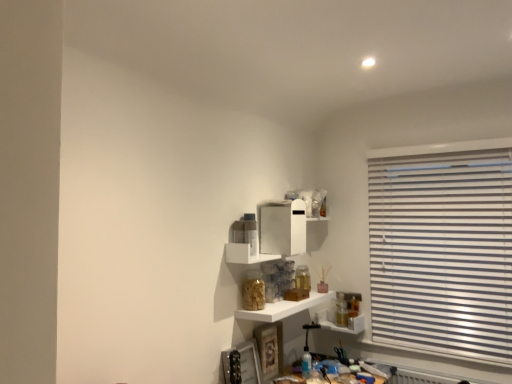
Locate an element on the screen. This screenshot has height=384, width=512. white glossy shelf at center, which is the second shelf from top to bottom is located at coordinates (284, 308).

Locate an element on the screen. The width and height of the screenshot is (512, 384). translucent glass jar at lower right, which appears as the first shelf when ordered from the bottom is located at coordinates (338, 325).

Does white glossy shelf at center, the 2th shelf when ordered from bottom to top, have a greater width compared to translucent glass jar at lower right, which appears as the first shelf when ordered from the bottom?

Yes.

Based on the photo, is white glossy shelf at center, the 2th shelf when ordered from bottom to top, looking in the opposite direction of translucent glass jar at lower right, which is the 3th shelf in top-to-bottom order?

No, translucent glass jar at lower right, which is the 3th shelf in top-to-bottom order, is not at the back of white glossy shelf at center, the 2th shelf when ordered from bottom to top.

Which object is closer to the camera, white glossy shelf at center, which is the second shelf from top to bottom, or translucent glass jar at lower right, which appears as the first shelf when ordered from the bottom?

white glossy shelf at center, which is the second shelf from top to bottom, is more forward.

Measure the distance from white glossy shelf at center, which is the second shelf from top to bottom, to translucent glass jar at lower right, which is the 3th shelf in top-to-bottom order.

The distance of white glossy shelf at center, which is the second shelf from top to bottom, from translucent glass jar at lower right, which is the 3th shelf in top-to-bottom order, is 43.45 centimeters.

From the image's perspective, relative to white glossy shelf at center, the 2th shelf when ordered from bottom to top, is translucent glass jar at lower right, which appears as the first shelf when ordered from the bottom, above or below?

Based on their image positions, translucent glass jar at lower right, which appears as the first shelf when ordered from the bottom, is located beneath white glossy shelf at center, the 2th shelf when ordered from bottom to top.

Looking at this image, is translucent glass jar at lower right, which appears as the first shelf when ordered from the bottom, not within white glossy shelf at center, which is the second shelf from top to bottom?

translucent glass jar at lower right, which appears as the first shelf when ordered from the bottom, is positioned outside white glossy shelf at center, which is the second shelf from top to bottom.

Looking at this image, considering the relative sizes of translucent glass jar at lower right, which is the 3th shelf in top-to-bottom order, and white glossy shelf at center, the 2th shelf when ordered from bottom to top, in the image provided, is translucent glass jar at lower right, which is the 3th shelf in top-to-bottom order, smaller than white glossy shelf at center, the 2th shelf when ordered from bottom to top,?

Correct, translucent glass jar at lower right, which is the 3th shelf in top-to-bottom order, occupies less space than white glossy shelf at center, the 2th shelf when ordered from bottom to top.

Does white glossy shelf at center, which ranks as the third shelf in bottom-to-top order, contain white glossy shelf at center, which is the second shelf from top to bottom?

No, white glossy shelf at center, which is the second shelf from top to bottom, is not inside white glossy shelf at center, which ranks as the third shelf in bottom-to-top order.

From a real-world perspective, is white glossy shelf at center, which ranks as the third shelf in bottom-to-top order, positioned under white glossy shelf at center, the 2th shelf when ordered from bottom to top, based on gravity?

No, from a real-world perspective, white glossy shelf at center, which ranks as the third shelf in bottom-to-top order, is not under white glossy shelf at center, the 2th shelf when ordered from bottom to top.

Is white glossy shelf at center, which ranks as the third shelf in bottom-to-top order, not near white glossy shelf at center, which is the second shelf from top to bottom?

That's not correct — white glossy shelf at center, which ranks as the third shelf in bottom-to-top order, is a little close to white glossy shelf at center, which is the second shelf from top to bottom.

Is point (236, 313) closer to viewer compared to point (279, 255)?

Yes, it is.

Can you confirm if white glossy shelf at center, the 2th shelf when ordered from bottom to top, is thinner than white glossy shelf at center, which ranks as the third shelf in bottom-to-top order?

No, white glossy shelf at center, the 2th shelf when ordered from bottom to top, is not thinner than white glossy shelf at center, which ranks as the third shelf in bottom-to-top order.

Could white glossy shelf at center, the 1th shelf positioned from the top, be considered to be inside white glossy shelf at center, which is the second shelf from top to bottom?

No, white glossy shelf at center, the 1th shelf positioned from the top, is not surrounded by white glossy shelf at center, which is the second shelf from top to bottom.

How many degrees apart are the facing directions of white glossy shelf at center, the 2th shelf when ordered from bottom to top, and white glossy shelf at center, the 1th shelf positioned from the top?

white glossy shelf at center, the 2th shelf when ordered from bottom to top, and white glossy shelf at center, the 1th shelf positioned from the top, are facing 0.0439 degrees away from each other.

Who is bigger, white glossy shelf at center, which ranks as the third shelf in bottom-to-top order, or translucent glass jar at lower right, which appears as the first shelf when ordered from the bottom?

With larger size is white glossy shelf at center, which ranks as the third shelf in bottom-to-top order.

Where is `shelf that is the 2nd one above the translucent glass jar at lower right, which appears as the first shelf when ordered from the bottom (from a real-world perspective)`? This screenshot has height=384, width=512. shelf that is the 2nd one above the translucent glass jar at lower right, which appears as the first shelf when ordered from the bottom (from a real-world perspective) is located at coordinates (245, 254).

Between white glossy shelf at center, which ranks as the third shelf in bottom-to-top order, and translucent glass jar at lower right, which is the 3th shelf in top-to-bottom order, which one has smaller width?

translucent glass jar at lower right, which is the 3th shelf in top-to-bottom order.

From the image's perspective, does white glossy shelf at center, which ranks as the third shelf in bottom-to-top order, appear lower than translucent glass jar at lower right, which appears as the first shelf when ordered from the bottom?

No, from the image's perspective, white glossy shelf at center, which ranks as the third shelf in bottom-to-top order, is not below translucent glass jar at lower right, which appears as the first shelf when ordered from the bottom.

Can white glossy shelf at center, the 1th shelf positioned from the top, be found inside translucent glass jar at lower right, which appears as the first shelf when ordered from the bottom?

Actually, white glossy shelf at center, the 1th shelf positioned from the top, is outside translucent glass jar at lower right, which appears as the first shelf when ordered from the bottom.

Which object is further away from the camera taking this photo, translucent glass jar at lower right, which is the 3th shelf in top-to-bottom order, or white glossy shelf at center, the 1th shelf positioned from the top?

translucent glass jar at lower right, which is the 3th shelf in top-to-bottom order, is further from the camera.

From a real-world perspective, which is physically above, translucent glass jar at lower right, which appears as the first shelf when ordered from the bottom, or white glossy shelf at center, the 1th shelf positioned from the top?

In real-world perspective, white glossy shelf at center, the 1th shelf positioned from the top, is above.

The image size is (512, 384). Identify the location of shelf that appears below the white glossy shelf at center, which is the second shelf from top to bottom (from a real-world perspective). (338, 325).

From a real-world perspective, starting from the translucent glass jar at lower right, which appears as the first shelf when ordered from the bottom, which shelf is the 1st one vertically above it? Please provide its 2D coordinates.

[(284, 308)]

Which object lies further to the anchor point white glossy shelf at center, the 1th shelf positioned from the top, translucent glass jar at lower right, which is the 3th shelf in top-to-bottom order, or white glossy shelf at center, which is the second shelf from top to bottom?

Among the two, translucent glass jar at lower right, which is the 3th shelf in top-to-bottom order, is located further to white glossy shelf at center, the 1th shelf positioned from the top.

Estimate the real-world distances between objects in this image. Which object is further from white glossy shelf at center, the 1th shelf positioned from the top, white glossy shelf at center, which is the second shelf from top to bottom, or translucent glass jar at lower right, which appears as the first shelf when ordered from the bottom?

Among the two, translucent glass jar at lower right, which appears as the first shelf when ordered from the bottom, is located further to white glossy shelf at center, the 1th shelf positioned from the top.

Estimate the real-world distances between objects in this image. Which object is further from white glossy shelf at center, the 2th shelf when ordered from bottom to top, translucent glass jar at lower right, which appears as the first shelf when ordered from the bottom, or white glossy shelf at center, which ranks as the third shelf in bottom-to-top order?

Among the two, translucent glass jar at lower right, which appears as the first shelf when ordered from the bottom, is located further to white glossy shelf at center, the 2th shelf when ordered from bottom to top.

From the picture: Based on their spatial positions, is white glossy shelf at center, which ranks as the third shelf in bottom-to-top order, or white glossy shelf at center, the 2th shelf when ordered from bottom to top, closer to translucent glass jar at lower right, which is the 3th shelf in top-to-bottom order?

The object closer to translucent glass jar at lower right, which is the 3th shelf in top-to-bottom order, is white glossy shelf at center, the 2th shelf when ordered from bottom to top.

Estimate the real-world distances between objects in this image. Which object is further from translucent glass jar at lower right, which is the 3th shelf in top-to-bottom order, white glossy shelf at center, which is the second shelf from top to bottom, or white glossy shelf at center, which ranks as the third shelf in bottom-to-top order?

The object further to translucent glass jar at lower right, which is the 3th shelf in top-to-bottom order, is white glossy shelf at center, which ranks as the third shelf in bottom-to-top order.

Based on their spatial positions, is white glossy shelf at center, which ranks as the third shelf in bottom-to-top order, or translucent glass jar at lower right, which is the 3th shelf in top-to-bottom order, closer to white glossy shelf at center, which is the second shelf from top to bottom?

white glossy shelf at center, which ranks as the third shelf in bottom-to-top order.

The width and height of the screenshot is (512, 384). Identify the location of shelf between white glossy shelf at center, which ranks as the third shelf in bottom-to-top order, and translucent glass jar at lower right, which is the 3th shelf in top-to-bottom order, in the front-back direction. (284, 308).